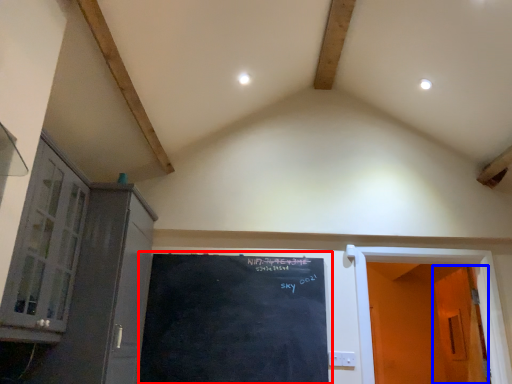
Question: Among these objects, which one is farthest to the camera, bulletin board (highlighted by a red box) or door (highlighted by a blue box)?

Choices:
 (A) bulletin board
 (B) door

Answer: (B)